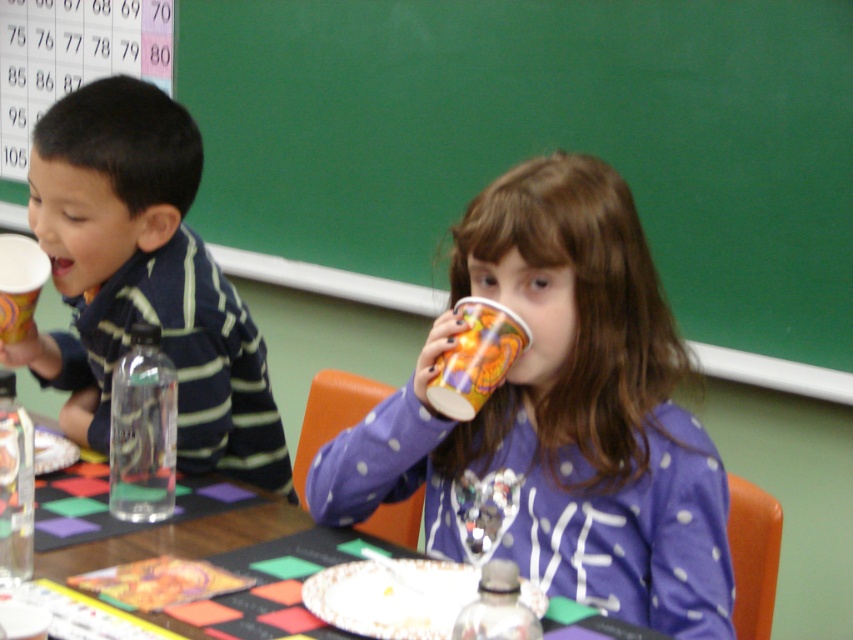
Does point (90, 422) lie in front of point (250, 598)?

That is False.

Image resolution: width=853 pixels, height=640 pixels. What are the coordinates of `matte black shirt at left` in the screenshot? It's located at (143, 280).

Measure the distance between point (233,440) and camera.

They are 5.17 feet apart.

Locate an element on the screen. This screenshot has height=640, width=853. matte black shirt at left is located at coordinates (143, 280).

In the scene shown: Can you confirm if matte black shirt at left is taller than clear plastic bottle at lower left?

Correct, matte black shirt at left is much taller as clear plastic bottle at lower left.

Is matte black shirt at left thinner than clear plastic bottle at lower left?

Incorrect, matte black shirt at left's width is not less than clear plastic bottle at lower left's.

Find the location of a particular element. matte black shirt at left is located at coordinates (143, 280).

Locate an element on the screen. matte black shirt at left is located at coordinates (143, 280).

Is transparent plastic bottle at center to the right of clear plastic bottle at lower left from the viewer's perspective?

Correct, you'll find transparent plastic bottle at center to the right of clear plastic bottle at lower left.

From the picture: Does transparent plastic bottle at center appear under clear plastic bottle at lower left?

Incorrect, transparent plastic bottle at center is not positioned below clear plastic bottle at lower left.

In order to click on transparent plastic bottle at center in this screenshot , I will do `click(142, 429)`.

The image size is (853, 640). I want to click on transparent plastic bottle at center, so tap(142, 429).